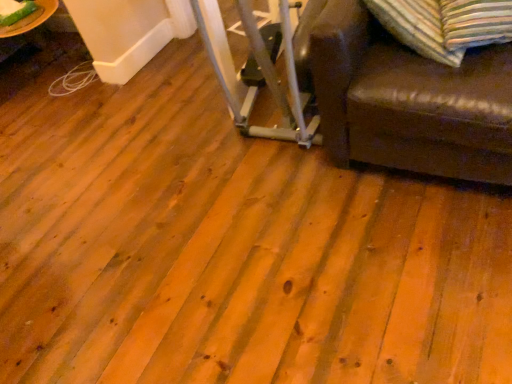
Locate an element on the screen. The height and width of the screenshot is (384, 512). green glass plate at upper left is located at coordinates (31, 19).

What do you see at coordinates (31, 19) in the screenshot? Image resolution: width=512 pixels, height=384 pixels. I see `green glass plate at upper left` at bounding box center [31, 19].

Image resolution: width=512 pixels, height=384 pixels. What do you see at coordinates (445, 25) in the screenshot?
I see `striped fabric pillow at upper right` at bounding box center [445, 25].

What is the approximate width of striped fabric pillow at upper right?

10.57 inches.

Find the location of `striped fabric pillow at upper right`. striped fabric pillow at upper right is located at coordinates (445, 25).

Measure the distance between point (429, 31) and camera.

The depth of point (429, 31) is 4.73 feet.

At what (x,y) coordinates should I click in order to perform the action: click on green glass plate at upper left. Please return your answer as a coordinate pair (x, y). Looking at the image, I should click on (31, 19).

Does green glass plate at upper left appear on the left side of striped fabric pillow at upper right?

Yes.

Which object is closer to the camera taking this photo, green glass plate at upper left or striped fabric pillow at upper right?

striped fabric pillow at upper right is in front.

Is point (45, 13) positioned before point (428, 24)?

No, it is not.

From the image's perspective, which one is positioned lower, green glass plate at upper left or striped fabric pillow at upper right?

striped fabric pillow at upper right.

From a real-world perspective, is green glass plate at upper left positioned above or below striped fabric pillow at upper right?

In terms of real-world spatial position, green glass plate at upper left is below striped fabric pillow at upper right.

Between green glass plate at upper left and striped fabric pillow at upper right, which one has larger width?

green glass plate at upper left.

Which of these two, green glass plate at upper left or striped fabric pillow at upper right, stands shorter?

With less height is green glass plate at upper left.

In terms of size, does green glass plate at upper left appear bigger or smaller than striped fabric pillow at upper right?

Considering their sizes, green glass plate at upper left takes up less space than striped fabric pillow at upper right.

Is green glass plate at upper left positioned beyond the bounds of striped fabric pillow at upper right?

Absolutely, green glass plate at upper left is external to striped fabric pillow at upper right.

Can you see green glass plate at upper left touching striped fabric pillow at upper right?

green glass plate at upper left is not next to striped fabric pillow at upper right, and they're not touching.

Is green glass plate at upper left facing away from striped fabric pillow at upper right?

No, green glass plate at upper left is not facing away from striped fabric pillow at upper right.

How different are the orientations of green glass plate at upper left and striped fabric pillow at upper right in degrees?

The angle between the facing direction of green glass plate at upper left and the facing direction of striped fabric pillow at upper right is 50 degrees.

How far apart are green glass plate at upper left and striped fabric pillow at upper right?

The distance of green glass plate at upper left from striped fabric pillow at upper right is 2.35 meters.

At what (x,y) coordinates should I click in order to perform the action: click on pillow above the green glass plate at upper left (from a real-world perspective). Please return your answer as a coordinate pair (x, y). The width and height of the screenshot is (512, 384). Looking at the image, I should click on (445, 25).

Considering the positions of objects striped fabric pillow at upper right and green glass plate at upper left in the image provided, who is more to the left, striped fabric pillow at upper right or green glass plate at upper left?

green glass plate at upper left is more to the left.

Is striped fabric pillow at upper right closer to camera compared to green glass plate at upper left?

Yes.

Which is in front, point (439, 25) or point (11, 27)?

The point (439, 25) is in front.

From the image's perspective, which is below, striped fabric pillow at upper right or green glass plate at upper left?

From the image's view, striped fabric pillow at upper right is below.

From a real-world perspective, is striped fabric pillow at upper right positioned under green glass plate at upper left based on gravity?

Incorrect, from a real-world perspective, striped fabric pillow at upper right is higher than green glass plate at upper left.

Looking at this image, which object is thinner, striped fabric pillow at upper right or green glass plate at upper left?

striped fabric pillow at upper right is thinner.

Consider the image. From their relative heights in the image, would you say striped fabric pillow at upper right is taller or shorter than green glass plate at upper left?

striped fabric pillow at upper right is taller than green glass plate at upper left.

Who is bigger, striped fabric pillow at upper right or green glass plate at upper left?

Bigger between the two is striped fabric pillow at upper right.

Is striped fabric pillow at upper right located outside green glass plate at upper left?

That's correct, striped fabric pillow at upper right is outside of green glass plate at upper left.

Is striped fabric pillow at upper right far from green glass plate at upper left?

striped fabric pillow at upper right is positioned a significant distance from green glass plate at upper left.

Could you tell me if striped fabric pillow at upper right is facing green glass plate at upper left?

No.

How many degrees apart are the facing directions of striped fabric pillow at upper right and green glass plate at upper left?

The angle between the facing direction of striped fabric pillow at upper right and the facing direction of green glass plate at upper left is 50 degrees.

How much distance is there between striped fabric pillow at upper right and green glass plate at upper left?

striped fabric pillow at upper right is 7.71 feet from green glass plate at upper left.

Identify the location of pillow above the green glass plate at upper left (from a real-world perspective). (445, 25).

Where is `pillow below the green glass plate at upper left (from the image's perspective)`? Image resolution: width=512 pixels, height=384 pixels. pillow below the green glass plate at upper left (from the image's perspective) is located at coordinates (445, 25).

This screenshot has height=384, width=512. There is a green glass plate at upper left. In order to click on pillow above it (from a real-world perspective) in this screenshot , I will do `click(445, 25)`.